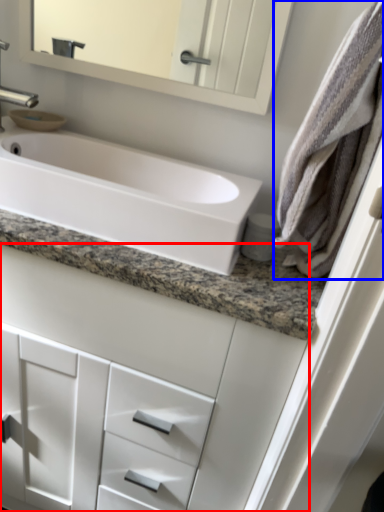
Question: Which object appears farthest to the camera in this image, bathroom cabinet (highlighted by a red box) or bath towel (highlighted by a blue box)?

Choices:
 (A) bathroom cabinet
 (B) bath towel

Answer: (A)